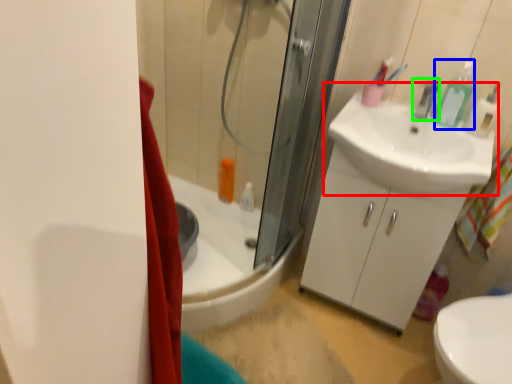
Question: Considering the real-world distances, which object is closest to sink (highlighted by a red box)? toiletry (highlighted by a blue box) or faucet (highlighted by a green box).

Choices:
 (A) toiletry
 (B) faucet

Answer: (A)